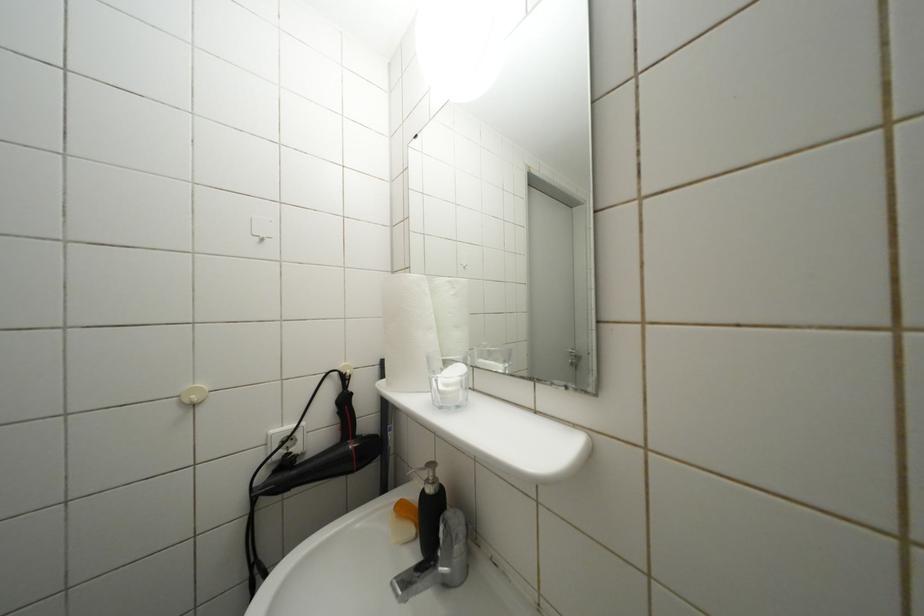
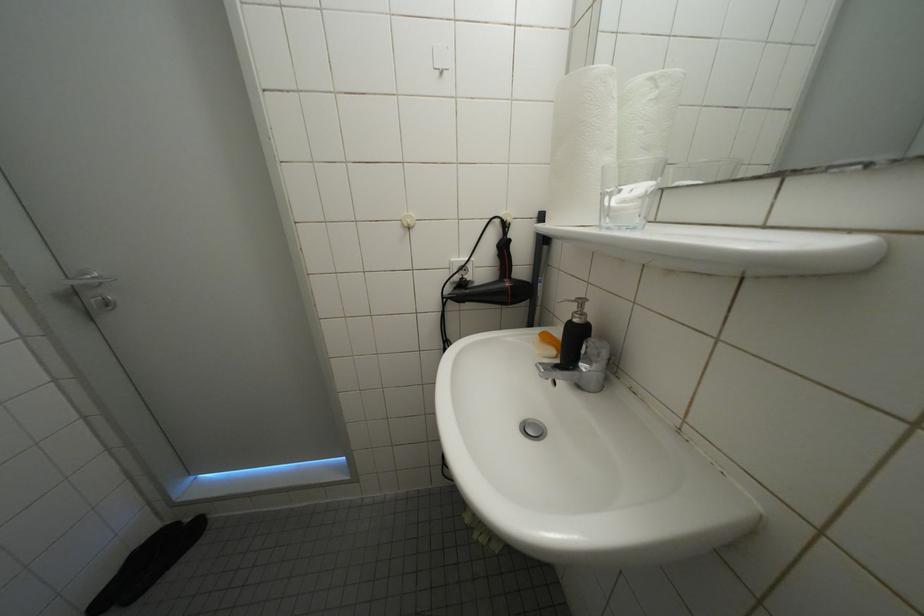
How did the camera likely rotate?

The rotation direction of the camera is left-down.